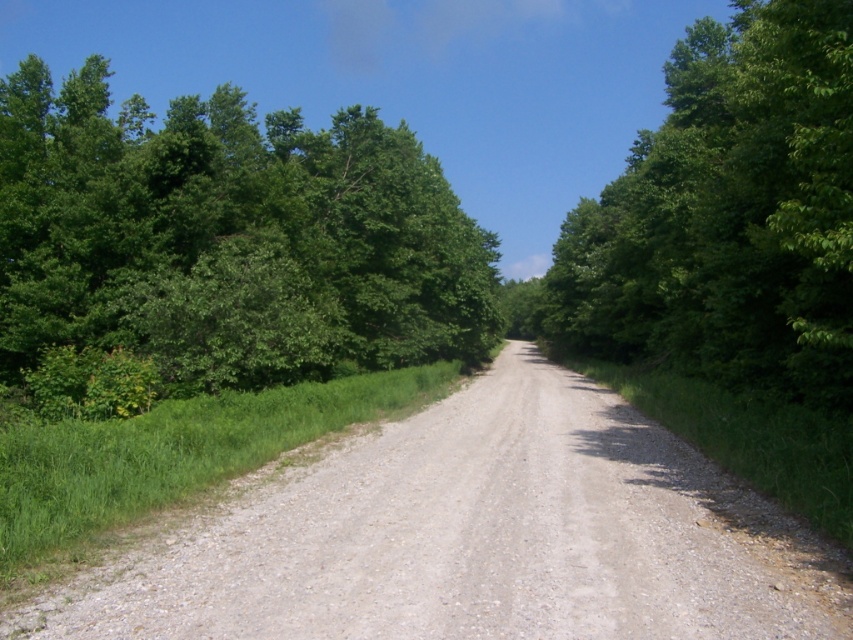
You are a hiker standing at the starting point of the gray gravel road at center. You notice a green leafy tree at left nearby. Which object is taller when viewed from your position?

The green leafy tree at left is taller than the gray gravel road at center.

In the scene shown: You are standing at the starting point of the gray gravel road at center. If you walk straight ahead along the road, which direction will the road curve towards?

The gray gravel road at center curves gently to the right as it extends towards the horizon.

You are a hiker planning to walk along the gray gravel road at center and pass by the green leafy tree at right. Based on their sizes, which one do you think is narrower?

The gray gravel road at center is smaller than the green leafy tree at right, so the gray gravel road at center is narrower.